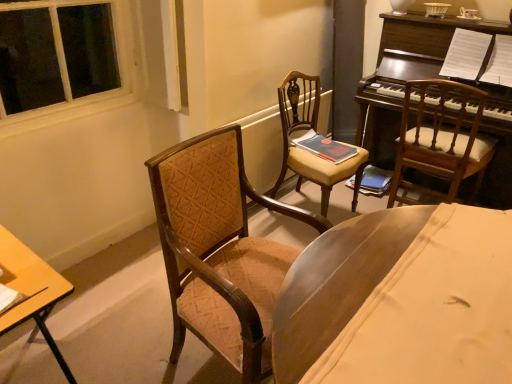
Question: Can you confirm if velvet brown armchair at center, positioned as the 1th chair in left-to-right order, is taller than wooden desk at lower left?

Choices:
 (A) yes
 (B) no

Answer: (A)

Question: Considering the relative sizes of velvet brown armchair at center, the third chair when ordered from right to left, and wooden desk at lower left in the image provided, is velvet brown armchair at center, the third chair when ordered from right to left, shorter than wooden desk at lower left?

Choices:
 (A) yes
 (B) no

Answer: (B)

Question: Is velvet brown armchair at center, the third chair when ordered from right to left, behind wooden desk at lower left?

Choices:
 (A) no
 (B) yes

Answer: (B)

Question: From the image's perspective, is velvet brown armchair at center, the third chair when ordered from right to left, located above wooden desk at lower left?

Choices:
 (A) yes
 (B) no

Answer: (A)

Question: Can we say velvet brown armchair at center, positioned as the 1th chair in left-to-right order, lies outside wooden desk at lower left?

Choices:
 (A) yes
 (B) no

Answer: (A)

Question: Is velvet brown armchair at center, positioned as the 1th chair in left-to-right order, taller or shorter than matte brown wooden chair at center, which is the second chair from left to right?

Choices:
 (A) tall
 (B) short

Answer: (A)

Question: In the image, is velvet brown armchair at center, the third chair when ordered from right to left, on the left side or the right side of matte brown wooden chair at center, which is the second chair from left to right?

Choices:
 (A) left
 (B) right

Answer: (A)

Question: Based on their sizes in the image, would you say velvet brown armchair at center, positioned as the 1th chair in left-to-right order, is bigger or smaller than matte brown wooden chair at center, which is counted as the 2th chair, starting from the right?

Choices:
 (A) small
 (B) big

Answer: (B)

Question: Is velvet brown armchair at center, the third chair when ordered from right to left, inside or outside of matte brown wooden chair at center, which is counted as the 2th chair, starting from the right?

Choices:
 (A) outside
 (B) inside

Answer: (A)

Question: In the image, is wooden chair at right, the first chair from the right, on the left side or the right side of matte red book at center, which is the 2th book in back-to-front order?

Choices:
 (A) left
 (B) right

Answer: (B)

Question: In terms of width, does wooden chair at right, which ranks as the 3th chair in left-to-right order, look wider or thinner when compared to matte red book at center, marked as the 1th book in a left-to-right arrangement?

Choices:
 (A) thin
 (B) wide

Answer: (B)

Question: Is wooden chair at right, which ranks as the 3th chair in left-to-right order, taller or shorter than matte red book at center, marked as the 1th book in a left-to-right arrangement?

Choices:
 (A) tall
 (B) short

Answer: (A)

Question: From the image's perspective, is wooden chair at right, the first chair from the right, located above or below matte red book at center, which is the 2th book in back-to-front order?

Choices:
 (A) above
 (B) below

Answer: (B)

Question: Looking at the image, does hardcover book at center, the second book when ordered from left to right, seem bigger or smaller compared to matte red book at center, the 2th book when ordered from right to left?

Choices:
 (A) small
 (B) big

Answer: (B)

Question: Is hardcover book at center, which is counted as the first book, starting from the back, in front of or behind matte red book at center, marked as the 1th book in a left-to-right arrangement, in the image?

Choices:
 (A) behind
 (B) front

Answer: (A)